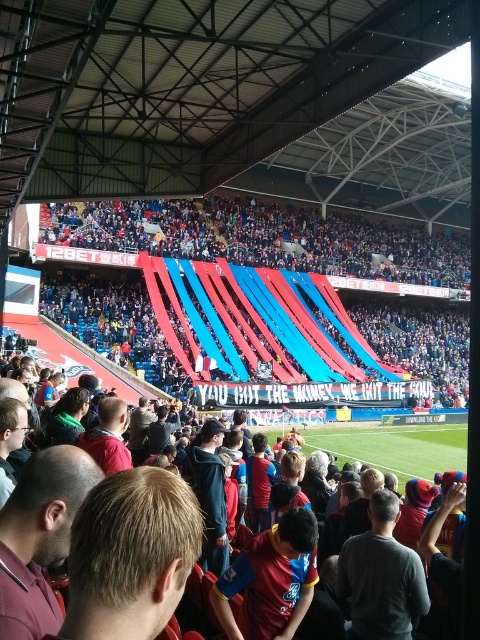
Question: Which of the following is the farthest from the observer?

Choices:
 (A) blue fabric banner at upper center
 (B) red jersey at center

Answer: (A)

Question: Does blue fabric banner at upper center appear on the left side of red jersey at center?

Choices:
 (A) no
 (B) yes

Answer: (A)

Question: Which object appears closest to the camera in this image?

Choices:
 (A) red jersey at center
 (B) blue fabric banner at upper center

Answer: (A)

Question: Which object appears closest to the camera in this image?

Choices:
 (A) red jersey at center
 (B) blue fabric banner at upper center

Answer: (A)

Question: Is blue fabric banner at upper center smaller than red jersey at center?

Choices:
 (A) yes
 (B) no

Answer: (B)

Question: Is the position of blue fabric banner at upper center more distant than that of red jersey at center?

Choices:
 (A) yes
 (B) no

Answer: (A)